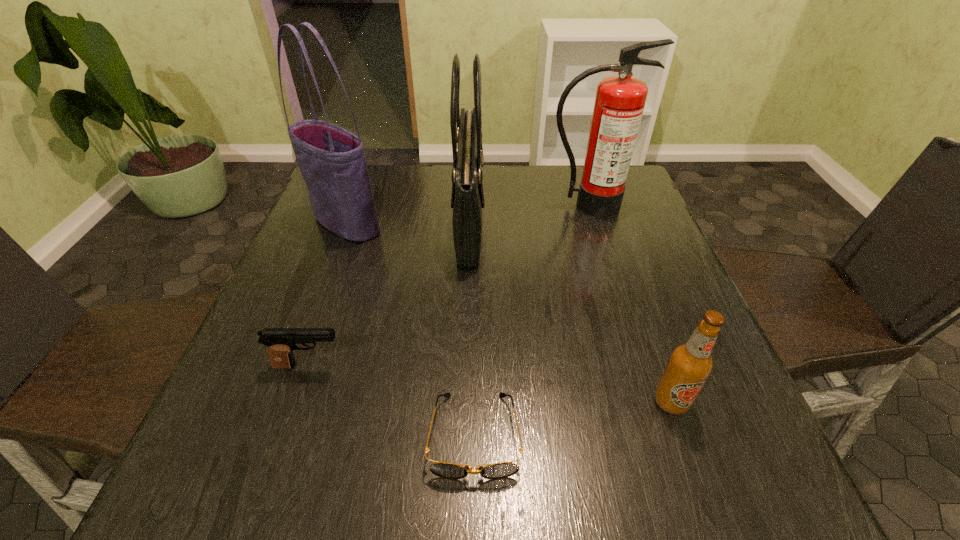
The width and height of the screenshot is (960, 540). I want to click on tote bag, so click(x=332, y=161).

The width and height of the screenshot is (960, 540). In order to click on fire extinguisher in this screenshot , I will do 620,100.

Find the location of a particular element. This screenshot has height=540, width=960. handbag is located at coordinates (467, 201).

The height and width of the screenshot is (540, 960). Find the location of `the fourth tallest object`. the fourth tallest object is located at coordinates (690, 364).

Locate an element on the screen. the fifth tallest object is located at coordinates (281, 342).

Identify the location of the fourth farthest object. The width and height of the screenshot is (960, 540). (281, 342).

I want to click on sunglasses, so click(x=446, y=470).

You are a GUI agent. You are given a task and a screenshot of the screen. Output one action in this format:
    pyautogui.click(x=<x>, y=<y>)
    Task: Click on the vacant space located 0.110m on the front of the tote bag
    The image size is (960, 540).
    Given the screenshot: What is the action you would take?
    pyautogui.click(x=327, y=274)

You are a GUI agent. You are given a task and a screenshot of the screen. Output one action in this format:
    pyautogui.click(x=<x>, y=<y>)
    Task: Click on the vacant space located 0.330m on the front-facing side of the fire extinguisher
    The height and width of the screenshot is (540, 960).
    Given the screenshot: What is the action you would take?
    pyautogui.click(x=621, y=310)

You are a GUI agent. You are given a task and a screenshot of the screen. Output one action in this format:
    pyautogui.click(x=<x>, y=<y>)
    Task: Click on the free region located 0.160m with an open clasp on the front of the handbag
    
    Given the screenshot: What is the action you would take?
    pyautogui.click(x=546, y=221)